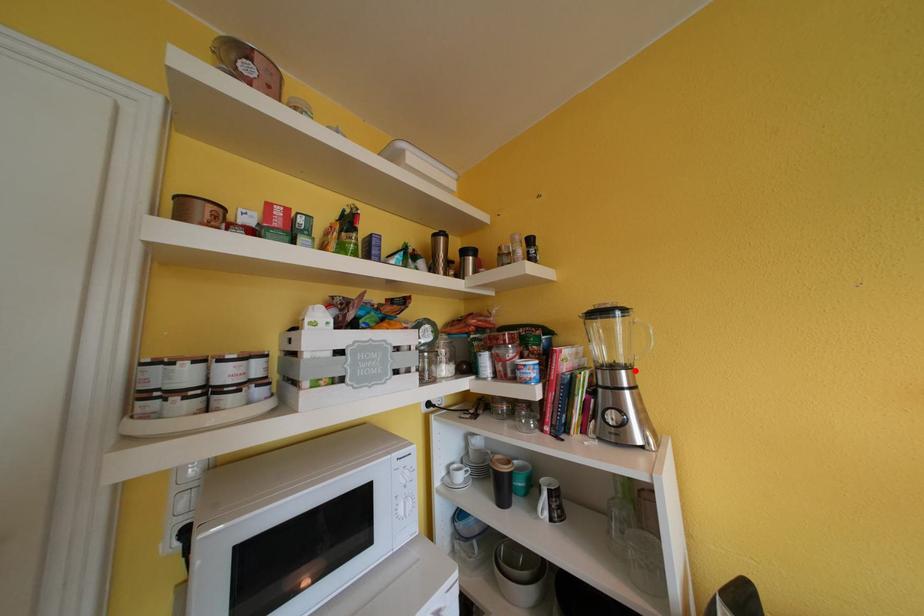
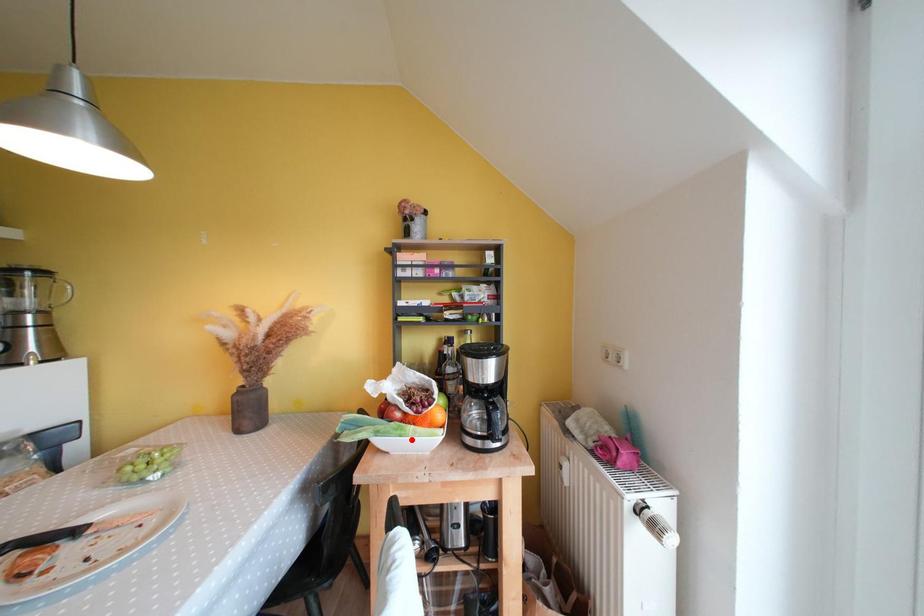
I am providing you with two images of the same scene from different viewpoints. A red point is marked on the first image and another point is marked on the second image. Is the red point in image1 aligned with the point shown in image2?

No